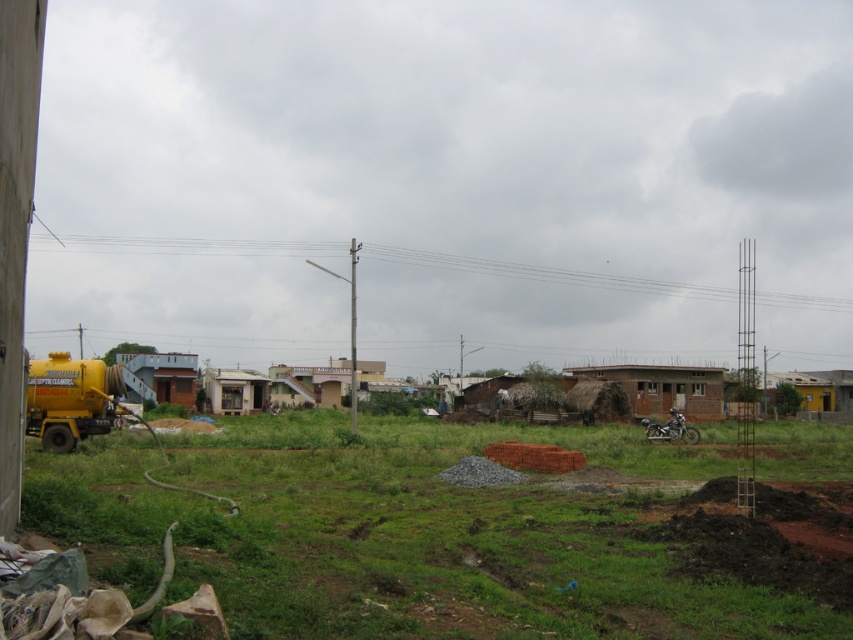
Question: Which of the following is the closest to the observer?

Choices:
 (A) brown brick hut at center-left
 (B) yellow brick house at center
 (C) yellow metallic truck at left
 (D) brown brick hut at center

Answer: (C)

Question: Which of these objects is positioned closest to the white painted wood hut at center?

Choices:
 (A) yellow metallic truck at left
 (B) yellow brick house at center
 (C) brown brick hut at center-left
 (D) brown brick hut at center

Answer: (C)

Question: Can you confirm if brown brick hut at center is positioned below white painted wood hut at center?

Choices:
 (A) no
 (B) yes

Answer: (A)

Question: Is yellow metallic truck at left positioned in front of brown brick hut at center?

Choices:
 (A) yes
 (B) no

Answer: (A)

Question: Is yellow metallic truck at left positioned in front of brown brick hut at center?

Choices:
 (A) no
 (B) yes

Answer: (B)

Question: Among these points, which one is nearest to the camera?

Choices:
 (A) (212, 372)
 (B) (141, 380)
 (C) (149, 547)
 (D) (380, 360)

Answer: (C)